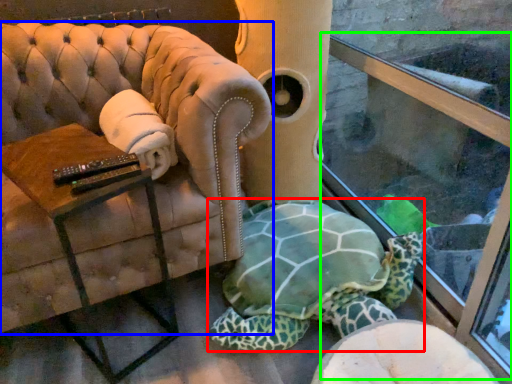
Question: Based on their relative distances, which object is nearer to tortoise (highlighted by a red box)? Choose from chair (highlighted by a blue box) and shop window (highlighted by a green box).

Choices:
 (A) chair
 (B) shop window

Answer: (B)